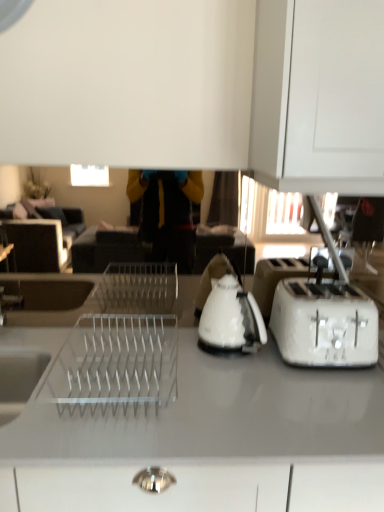
This screenshot has height=512, width=384. In order to click on vacant region in front of white plastic toaster at right in this screenshot , I will do `click(326, 395)`.